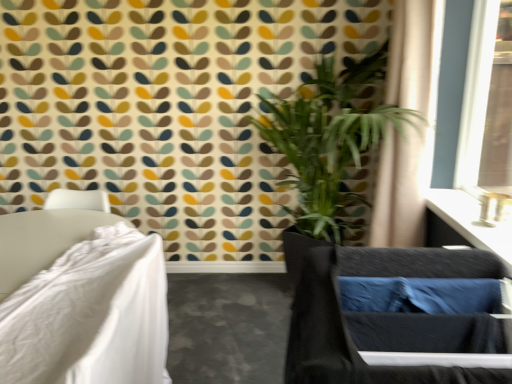
Question: From a real-world perspective, is green leafy plant at center over satin black vanity at upper right?

Choices:
 (A) yes
 (B) no

Answer: (A)

Question: Does green leafy plant at center lie in front of satin black vanity at upper right?

Choices:
 (A) yes
 (B) no

Answer: (B)

Question: Does green leafy plant at center have a greater width compared to satin black vanity at upper right?

Choices:
 (A) no
 (B) yes

Answer: (B)

Question: Is green leafy plant at center aimed at satin black vanity at upper right?

Choices:
 (A) no
 (B) yes

Answer: (A)

Question: Does green leafy plant at center come behind satin black vanity at upper right?

Choices:
 (A) no
 (B) yes

Answer: (B)

Question: From the image's perspective, is beige fabric curtain at upper right positioned above or below green leafy plant at center?

Choices:
 (A) below
 (B) above

Answer: (B)

Question: Visually, is beige fabric curtain at upper right positioned to the left or to the right of green leafy plant at center?

Choices:
 (A) left
 (B) right

Answer: (B)

Question: Is beige fabric curtain at upper right bigger or smaller than green leafy plant at center?

Choices:
 (A) big
 (B) small

Answer: (B)

Question: Is beige fabric curtain at upper right taller or shorter than green leafy plant at center?

Choices:
 (A) tall
 (B) short

Answer: (B)

Question: Is point (289, 244) closer or farther from the camera than point (102, 213)?

Choices:
 (A) closer
 (B) farther

Answer: (B)

Question: From the image's perspective, relative to white fabric bed at left, is green leafy plant at center above or below?

Choices:
 (A) above
 (B) below

Answer: (A)

Question: From a real-world perspective, is green leafy plant at center above or below white fabric bed at left?

Choices:
 (A) below
 (B) above

Answer: (B)

Question: Based on their sizes in the image, would you say green leafy plant at center is bigger or smaller than white fabric bed at left?

Choices:
 (A) big
 (B) small

Answer: (A)

Question: From a real-world perspective, is beige fabric curtain at upper right above or below black fabric swivel chair at lower right?

Choices:
 (A) above
 (B) below

Answer: (A)

Question: Based on their sizes in the image, would you say beige fabric curtain at upper right is bigger or smaller than black fabric swivel chair at lower right?

Choices:
 (A) small
 (B) big

Answer: (A)